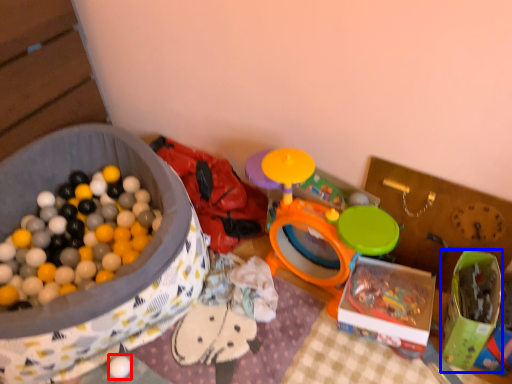
Question: Among these objects, which one is nearest to the camera, toy (highlighted by a red box) or box (highlighted by a blue box)?

Choices:
 (A) toy
 (B) box

Answer: (B)